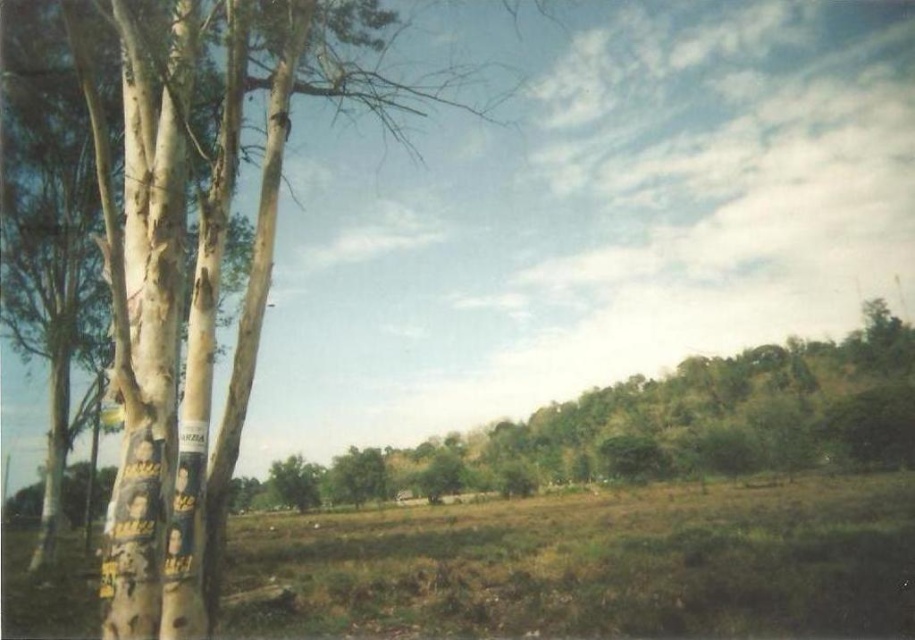
You are standing at the center of the field in the image. You see a point marked at coordinates (x=202, y=273). Which object does this point correspond to?

The point at coordinates (x=202, y=273) corresponds to the white rough bark tree at left.

You are a bird looking for a nesting spot. You see the white rough bark tree at left and the green leafy tree at center. Which tree would you choose if you want to build your nest higher up?

The white rough bark tree at left is much taller than the green leafy tree at center, so the bird would choose the white rough bark tree at left to build its nest higher up.